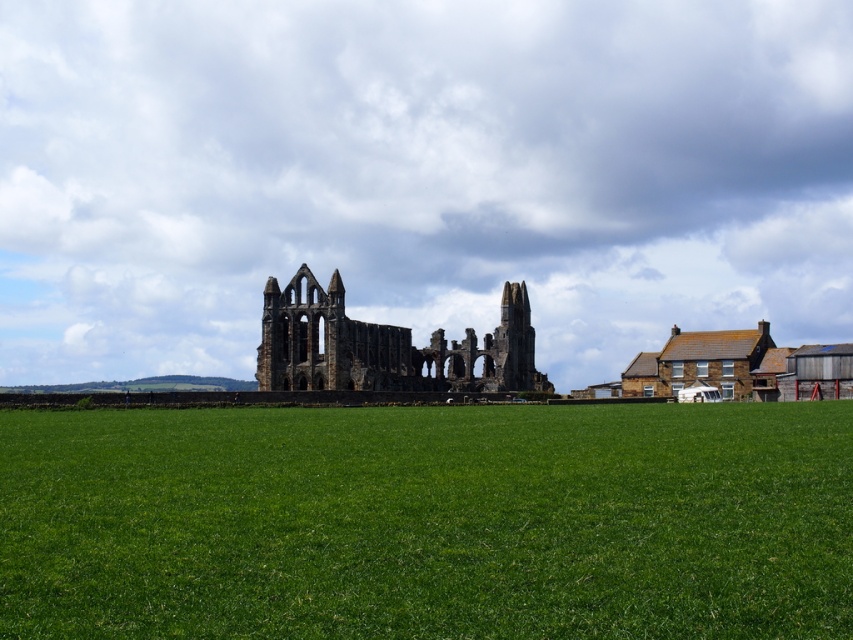
You are a photographer planning to capture the stone ruins at center against the green grass at center. Based on the scene description, which object should appear closer to the camera in your photo?

The green grass at center is in front of the stone ruins at center, so it will appear closer to the camera in the photo.

You are standing at the point labeled as point (427, 522) in the image. What is the immediate surface you are standing on?

The point labeled as point (427, 522) indicates green grass at center, so the immediate surface you are standing on is green grass at center.

In the scene shown: You are standing at the entrance of the stone ruins at center and want to reach the green grass at center. In which direction should you walk?

You should walk to the right to reach the green grass at center, as it is located to the right of the stone ruins at center.